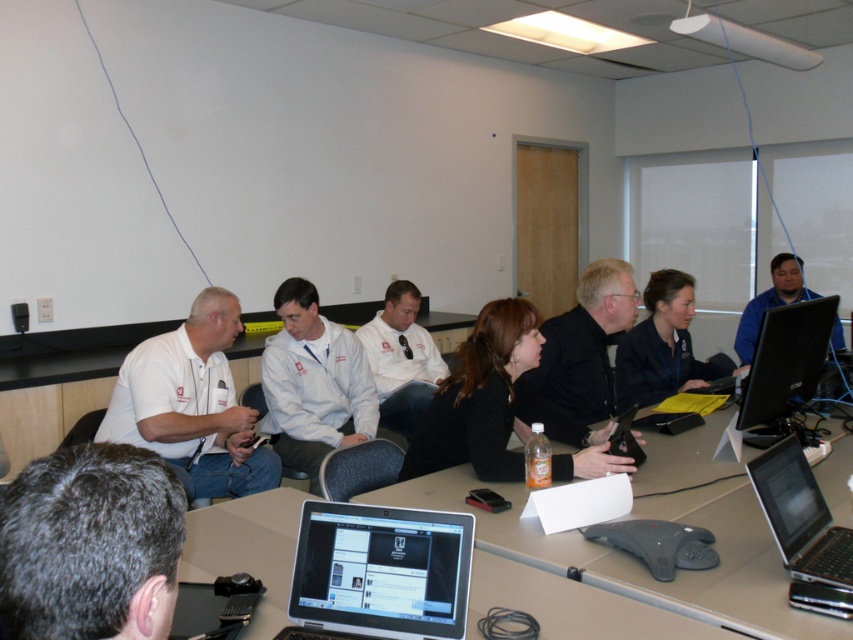
You are a participant in the meeting and need to place a 3cm thick notebook on the table. Which laptop, the silver metallic laptop at center or the silver metallic laptop at lower right, would allow you to place the notebook without covering it?

The silver metallic laptop at lower right is taller than the silver metallic laptop at center, so placing the notebook on the taller laptop at lower right would not cover it as much as the shorter one.